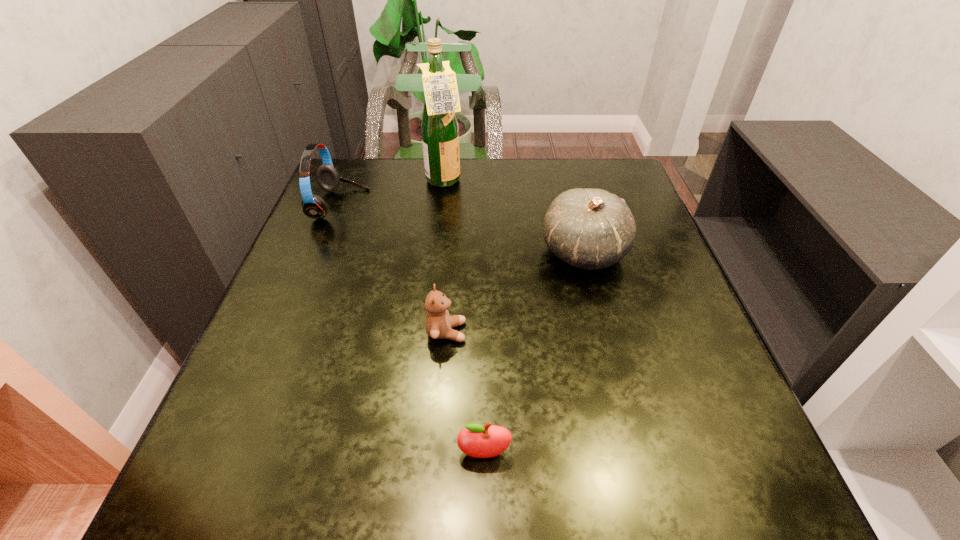
Locate an element on the screen. This screenshot has height=540, width=960. vacant space at the left edge of the desktop is located at coordinates (300, 300).

The height and width of the screenshot is (540, 960). In the image, there is a desktop. Identify the location of blank space at the right edge. (645, 220).

The width and height of the screenshot is (960, 540). In order to click on vacant space at the far left corner of the desktop in this screenshot , I will do `click(340, 173)`.

Find the location of `vacant space that's between the leftmost object and the apple`. vacant space that's between the leftmost object and the apple is located at coordinates (412, 329).

Locate an element on the screen. The width and height of the screenshot is (960, 540). empty space that is in between the nearest object and the second nearest object is located at coordinates (466, 393).

Where is `empty space that is in between the headset and the nearest object`? The height and width of the screenshot is (540, 960). empty space that is in between the headset and the nearest object is located at coordinates (412, 329).

You are a GUI agent. You are given a task and a screenshot of the screen. Output one action in this format:
    pyautogui.click(x=<x>, y=<y>)
    Task: Click on the free space between the second shortest object and the nearest object
    The image size is (960, 540).
    Given the screenshot: What is the action you would take?
    pyautogui.click(x=466, y=393)

Locate an element on the screen. Image resolution: width=960 pixels, height=540 pixels. empty space between the fourth farthest object and the rightmost object is located at coordinates (516, 292).

Where is `free space between the apple and the teddy bear`? The width and height of the screenshot is (960, 540). free space between the apple and the teddy bear is located at coordinates (466, 393).

Locate an element on the screen. The width and height of the screenshot is (960, 540). free space between the fourth farthest object and the gourd is located at coordinates (516, 292).